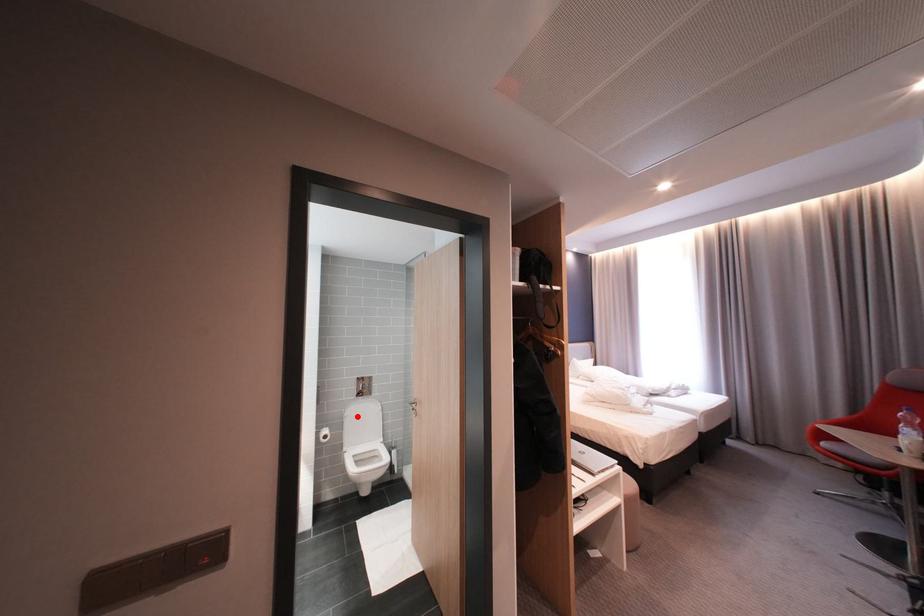
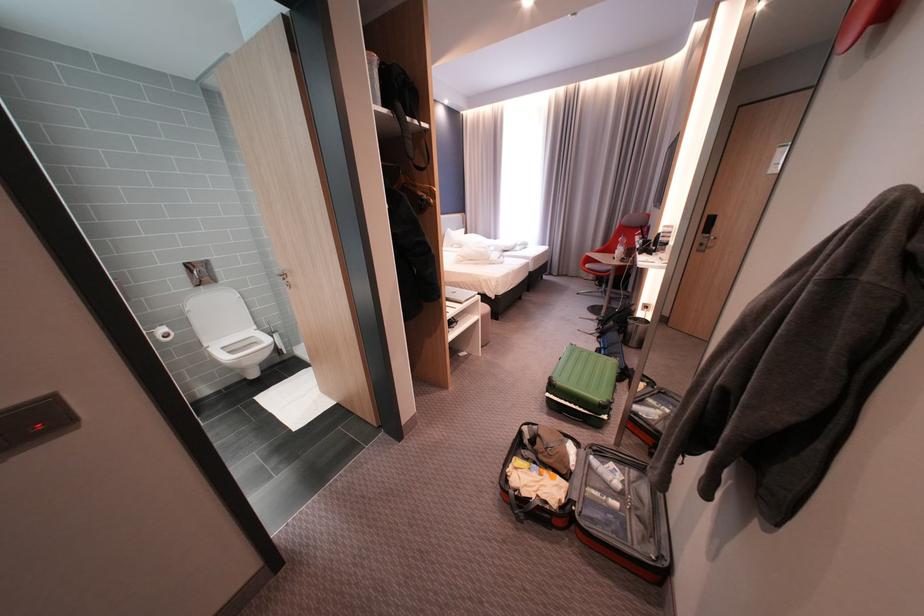
Question: I am providing you with two images of the same scene from different viewpoints. Image1 has a red point marked. In image2, the corresponding 3D location appears at what relative position? Reply with the corresponding letter.

Choices:
 (A) Closer
 (B) Farther

Answer: (A)